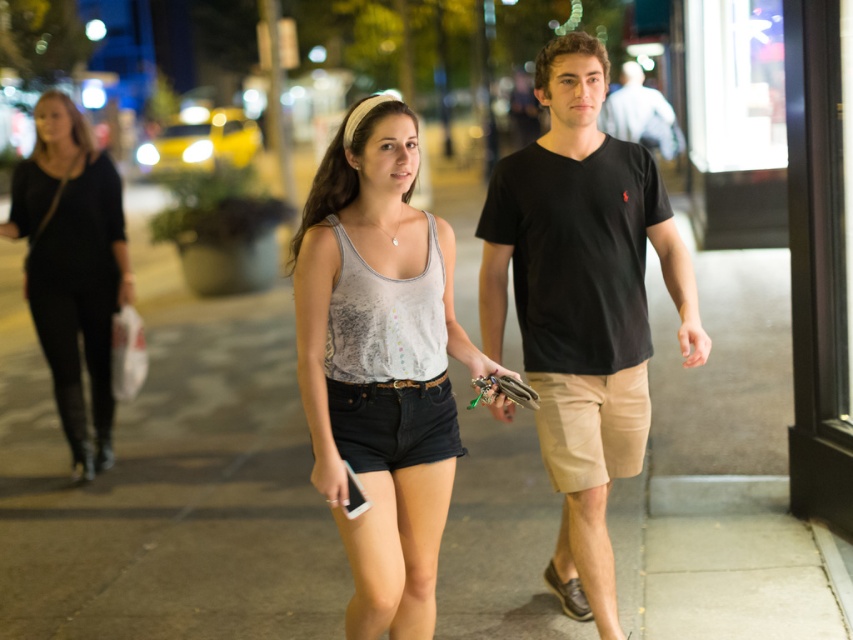
Question: Which point is closer to the camera?

Choices:
 (A) (576, 608)
 (B) (608, 289)
 (C) (68, 348)
 (D) (390, 182)

Answer: (D)

Question: Among these points, which one is farthest from the camera?

Choices:
 (A) (592, 616)
 (B) (54, 378)
 (C) (347, 180)

Answer: (B)

Question: Is black cotton t-shirt at center to the left of black leather pants at left from the viewer's perspective?

Choices:
 (A) yes
 (B) no

Answer: (B)

Question: Which of the following is the farthest from the observer?

Choices:
 (A) (583, 595)
 (B) (397, 474)
 (C) (16, 204)

Answer: (C)

Question: Can you confirm if black cotton t-shirt at center is thinner than black leather pants at left?

Choices:
 (A) yes
 (B) no

Answer: (B)

Question: In this image, where is black cotton t-shirt at center located relative to black leather pants at left?

Choices:
 (A) right
 (B) left

Answer: (A)